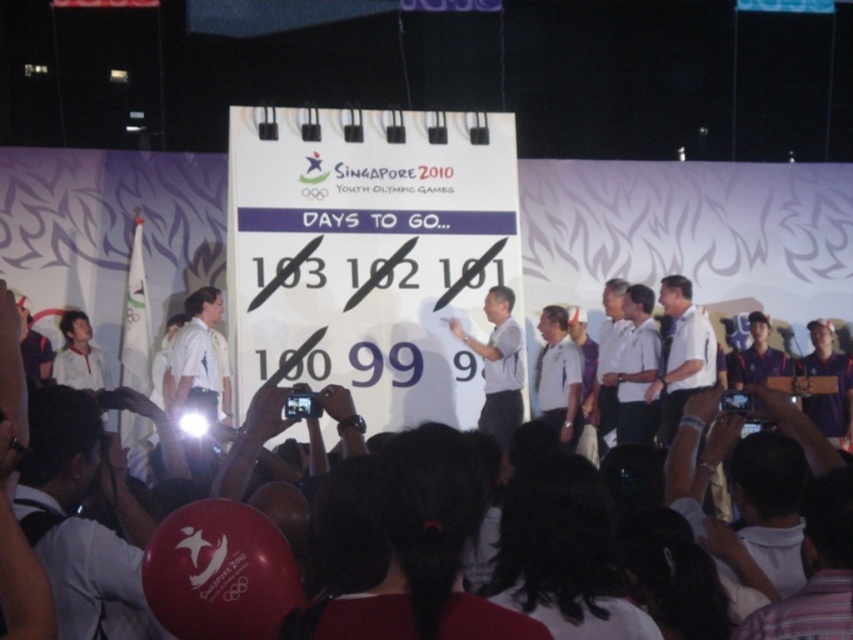
Question: Which object appears closest to the camera in this image?

Choices:
 (A) white smooth shirt at center
 (B) gray matte shirt at center

Answer: (B)

Question: Is white smooth shirt at center bigger than gray matte shirt at center?

Choices:
 (A) yes
 (B) no

Answer: (A)

Question: Observing the image, what is the correct spatial positioning of white smooth shirt at center in reference to gray matte shirt at center?

Choices:
 (A) below
 (B) above

Answer: (A)

Question: Among these objects, which one is nearest to the camera?

Choices:
 (A) white smooth shirt at center
 (B) gray matte shirt at center

Answer: (B)

Question: Does white smooth shirt at center have a lesser width compared to gray matte shirt at center?

Choices:
 (A) yes
 (B) no

Answer: (B)

Question: Which of the following is the farthest from the observer?

Choices:
 (A) white smooth shirt at center
 (B) gray matte shirt at center

Answer: (A)